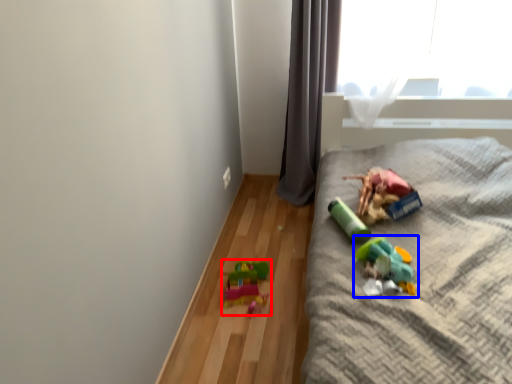
Question: Among these objects, which one is farthest to the camera, toy (highlighted by a red box) or toy (highlighted by a blue box)?

Choices:
 (A) toy
 (B) toy

Answer: (A)